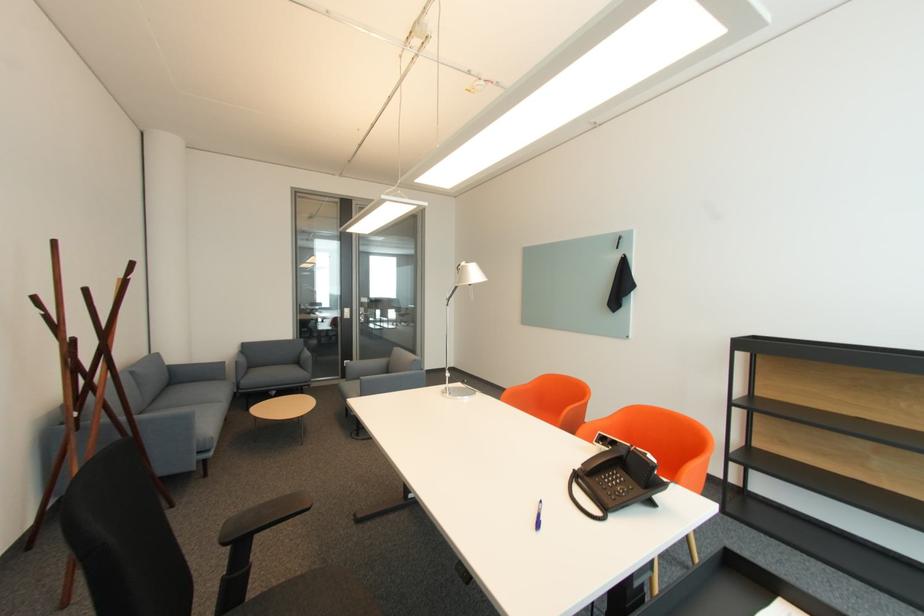
Where would you lift the telephone handset? Please return your answer as a coordinate pair (x, y).

(603, 458)